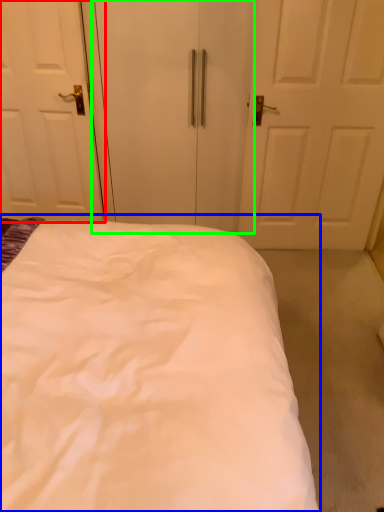
Question: Based on their relative distances, which object is nearer to door (highlighted by a red box)? Choose from bed (highlighted by a blue box) and screen door (highlighted by a green box).

Choices:
 (A) bed
 (B) screen door

Answer: (B)